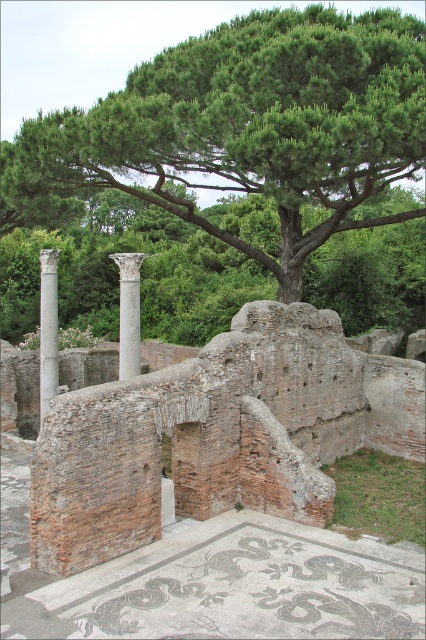
Based on the photo, you are standing at the archaeological site and want to take a photo of both the mosaic floor and the leaning column. Based on their positions, which point is closer to your camera lens, point (210, 225) or point (55, 323)?

Point (55, 323) is closer to the camera lens because the Objects Description states that point (210, 225) is further away than point (55, 323).

You are an archaeologist examining the ancient site. You notice the brick wall at center and the white marble column at center. Which structure is taller?

The brick wall at center is much taller than the white marble column at center.

You are an archaeologist examining the site. You need to determine the spatial relationship between the brick wall at center and the white marble column at left. Which object is positioned lower in the scene?

The brick wall at center is positioned lower than the white marble column at left as it is described to be below it.